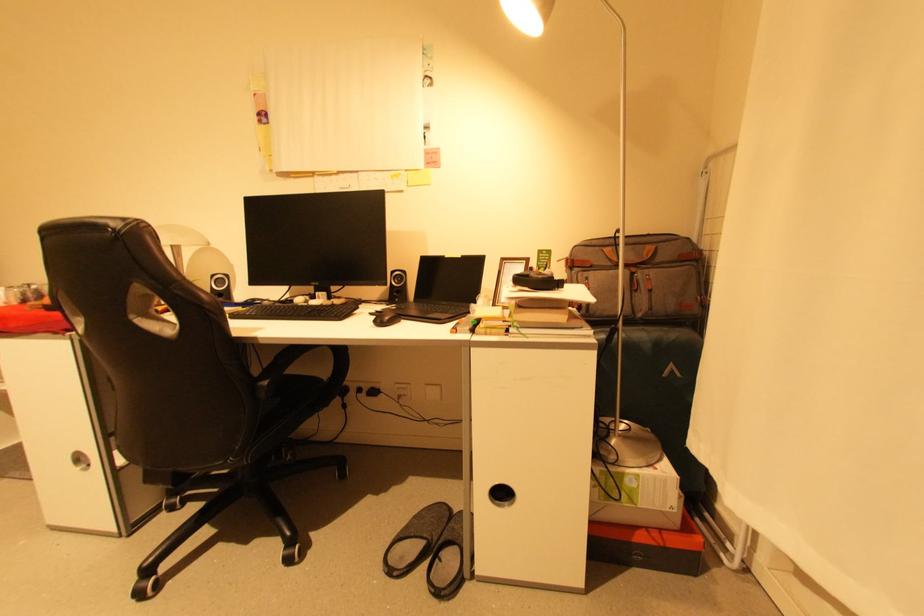
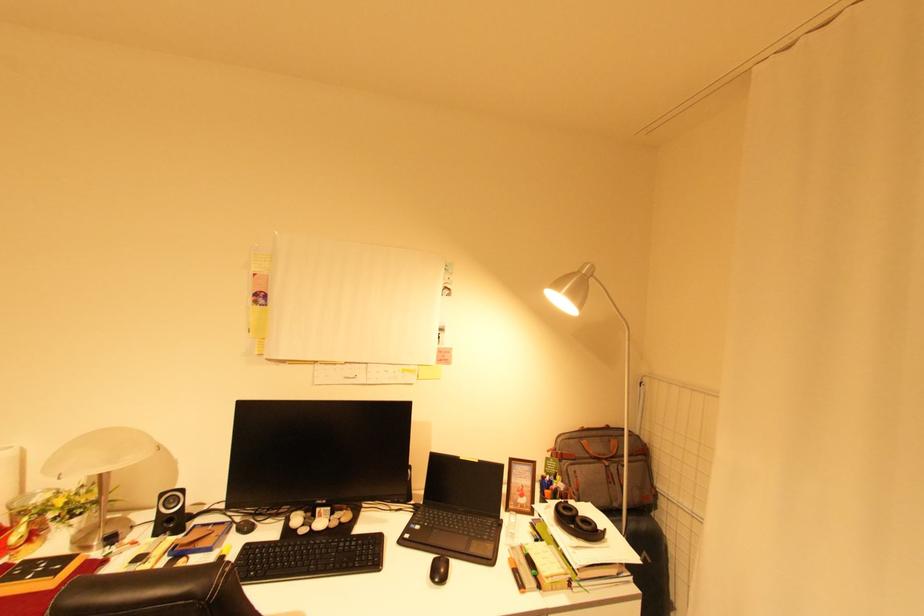
Question: The images are taken continuously from a first-person perspective. In which direction is your viewpoint rotating?

Choices:
 (A) Left
 (B) Right
 (C) Up
 (D) Down

Answer: (B)